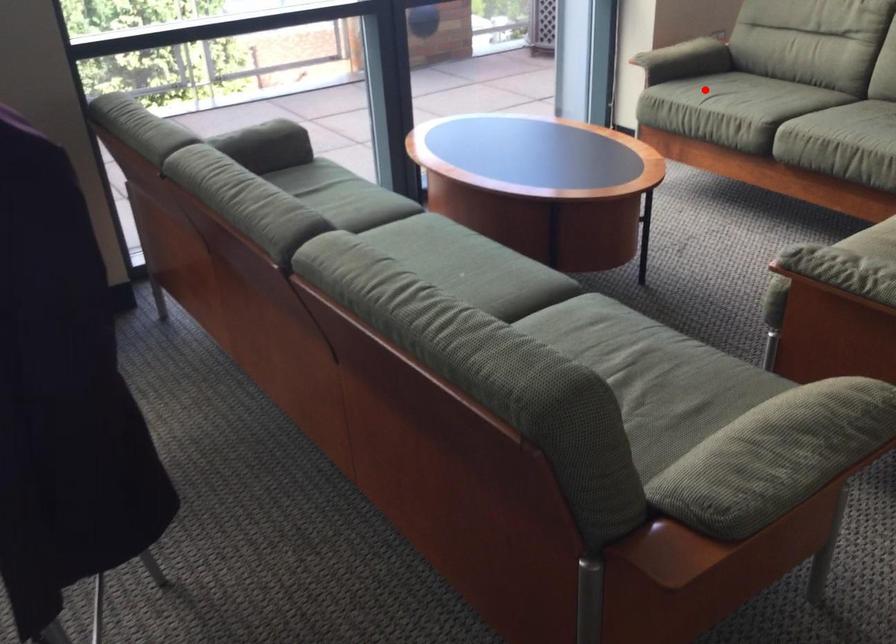
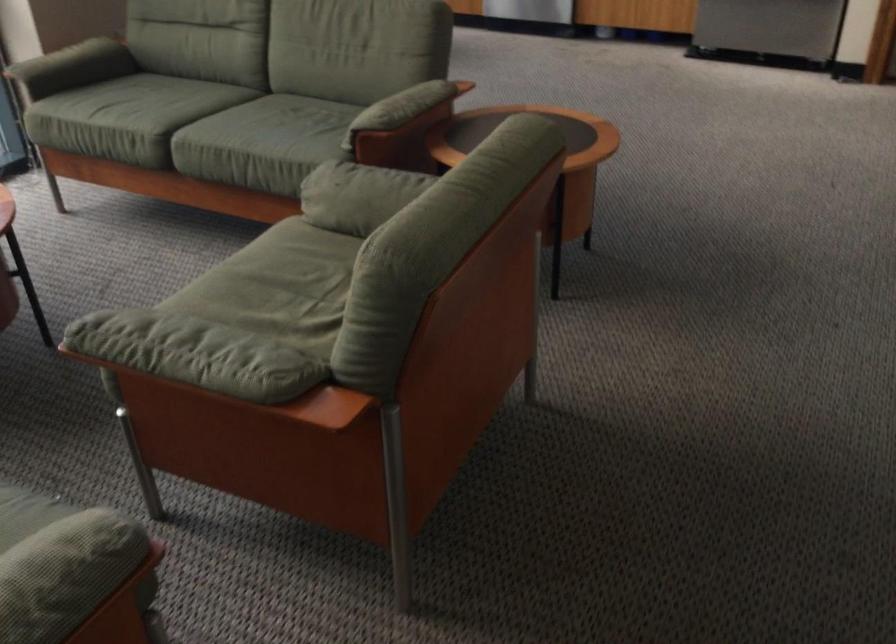
Find the pixel in the second image that matches the highlighted location in the first image.

(97, 108)